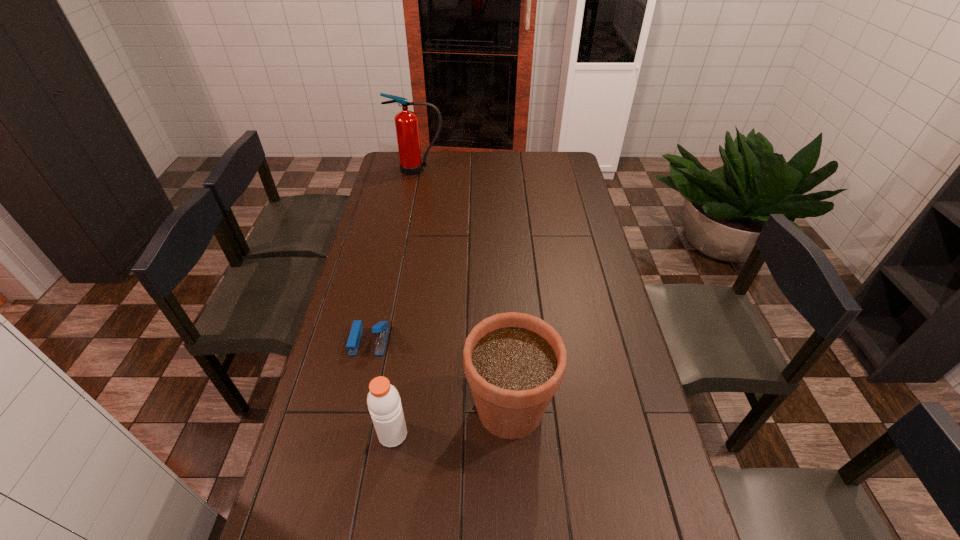
The height and width of the screenshot is (540, 960). I want to click on fire extinguisher, so click(x=406, y=122).

Where is `the tallest object`? The width and height of the screenshot is (960, 540). the tallest object is located at coordinates (406, 122).

This screenshot has height=540, width=960. Find the location of `flowerpot`. flowerpot is located at coordinates coord(514,362).

Find the location of a particular element. shaker is located at coordinates (383, 400).

The width and height of the screenshot is (960, 540). I want to click on the shortest object, so click(381, 328).

Image resolution: width=960 pixels, height=540 pixels. What are the coordinates of `stapler` in the screenshot? It's located at (381, 328).

The image size is (960, 540). I want to click on vacant area located on the front of the fire extinguisher, so click(x=411, y=206).

I want to click on vacant position located 0.370m on the back of the rightmost object, so click(503, 283).

At what (x,y) coordinates should I click in order to perform the action: click on free point located on the back of the shaker. Please return your answer as a coordinate pair (x, y). Looking at the image, I should click on (400, 385).

I want to click on vacant area situated on the back of the second farthest object, so click(x=387, y=264).